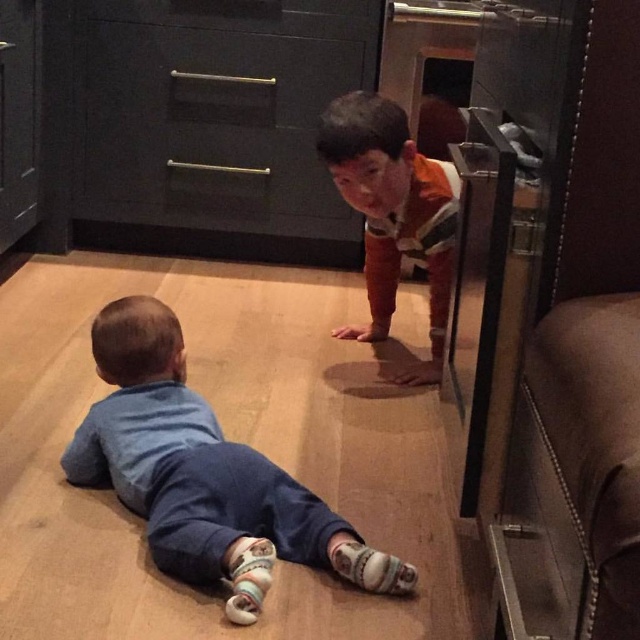
Question: Does matte black drawer at upper center lie behind blue soft fabric toddler at lower left?

Choices:
 (A) no
 (B) yes

Answer: (B)

Question: Which object appears farthest from the camera in this image?

Choices:
 (A) orange striped shirt at center
 (B) matte black drawer at upper center
 (C) blue soft fabric toddler at lower left

Answer: (B)

Question: Which point is farther to the camera?

Choices:
 (A) (225, 115)
 (B) (227, 600)

Answer: (A)

Question: Among these points, which one is nearest to the camera?

Choices:
 (A) (112, 472)
 (B) (266, 32)

Answer: (A)

Question: Is matte black drawer at upper center in front of orange striped shirt at center?

Choices:
 (A) no
 (B) yes

Answer: (A)

Question: Can you confirm if matte black drawer at upper center is positioned above orange striped shirt at center?

Choices:
 (A) no
 (B) yes

Answer: (B)